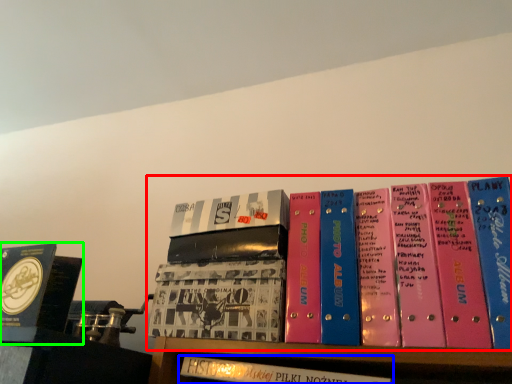
Question: Which object is the farthest from book (highlighted by a red box)? Choose among these: book (highlighted by a blue box) or book (highlighted by a green box).

Choices:
 (A) book
 (B) book

Answer: (B)